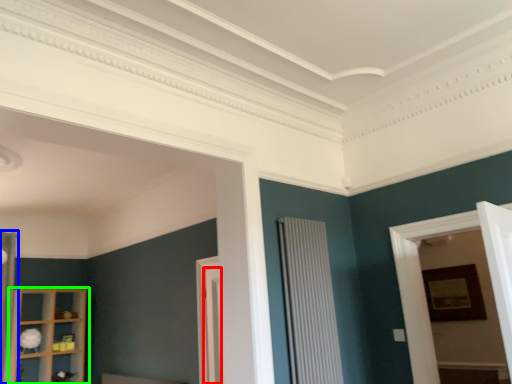
Question: Which object is positioned closest to door (highlighted by a red box)? Select from curtain (highlighted by a blue box) and shelf (highlighted by a green box).

Choices:
 (A) curtain
 (B) shelf

Answer: (B)